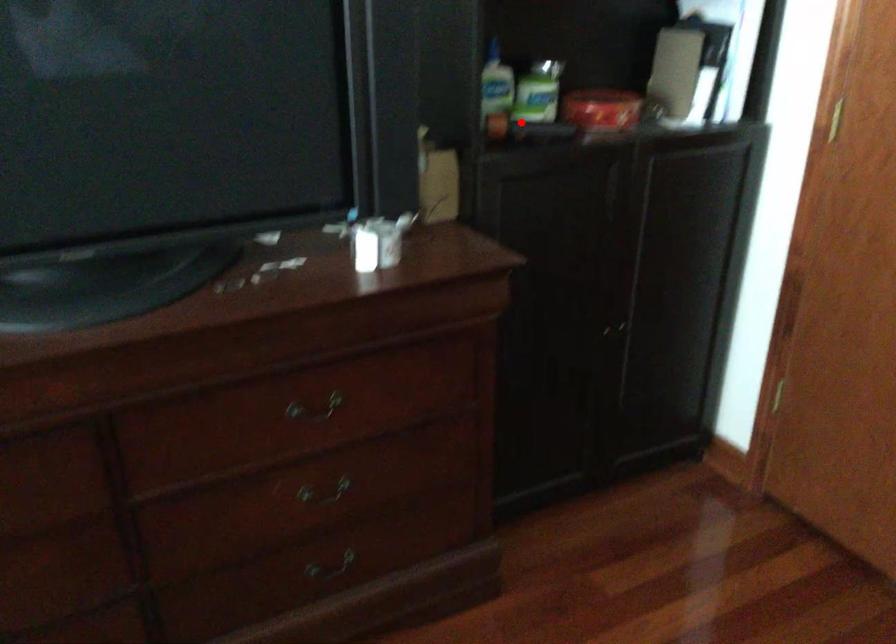
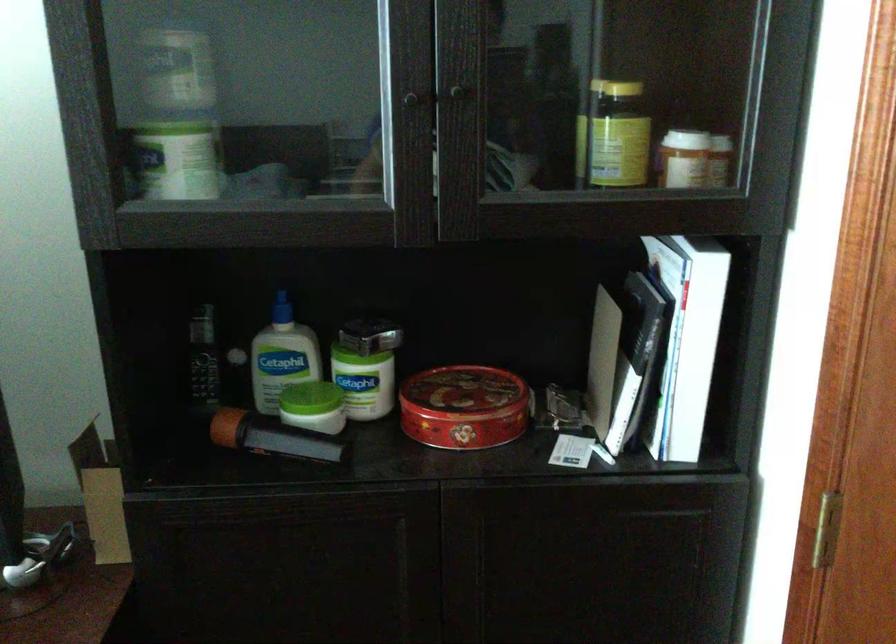
In the second image, find the point that corresponds to the highlighted location in the first image.

(268, 436)